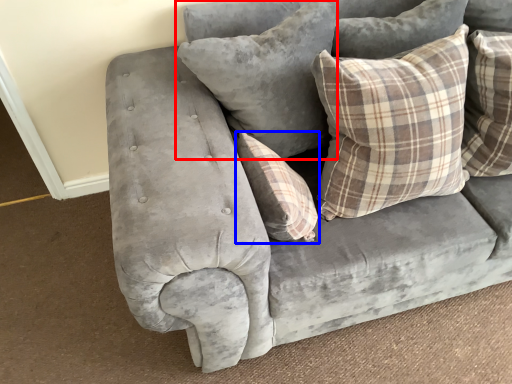
Question: Which of the following is the farthest to the observer, pillow (highlighted by a red box) or pillow (highlighted by a blue box)?

Choices:
 (A) pillow
 (B) pillow

Answer: (A)